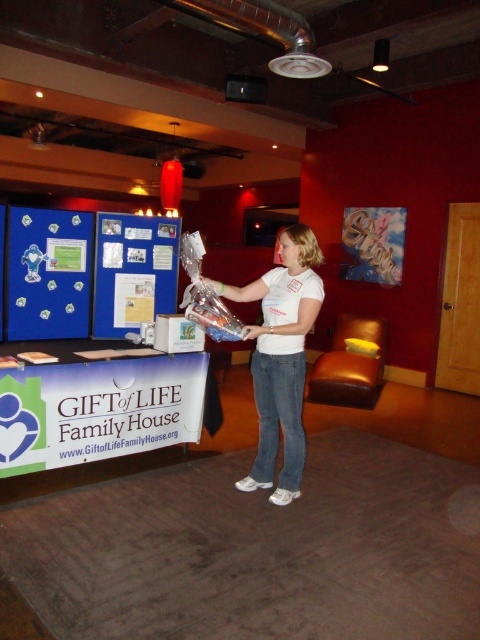
You are an event planner arranging items in the room. You have a white matte shirt at center and a blue fabric bulletin board at center. Which object is wider?

The white matte shirt at center is wider than the blue fabric bulletin board at center.

You are an event planner looking at the setup of the room. The white matte shirt at center and the blue fabric bulletin board at center are both near the center of the room. Which one is positioned lower in the scene?

The white matte shirt at center is below the blue fabric bulletin board at center, so the white matte shirt at center is positioned lower in the scene.

You are a photographer setting up for an event. You need to ensure that the white matte shirt at center and the blue fabric bulletin board at center are both visible in your photo. Given their heights, which object should you adjust the camera angle to focus on first to include both in the frame?

The white matte shirt at center is taller than the blue fabric bulletin board at center. To include both in the frame, adjust the camera angle to focus on the taller object first, which is the white matte shirt at center, then ensure the shorter blue fabric bulletin board at center is also visible.